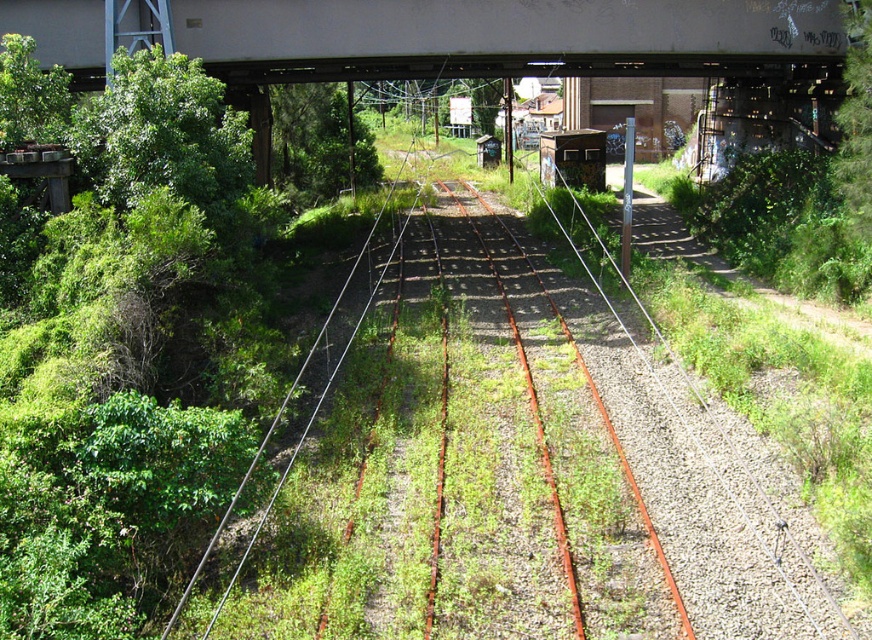
Does point (142, 161) come behind point (319, 104)?

No, (142, 161) is in front of (319, 104).

Looking at this image, which is above, green leafy tree at left or green leafy tree at center?

green leafy tree at center is higher up.

Measure the distance between green leafy tree at left and camera.

The distance of green leafy tree at left from camera is 12.51 meters.

At what (x,y) coordinates should I click in order to perform the action: click on green leafy tree at left. Please return your answer as a coordinate pair (x, y). Image resolution: width=872 pixels, height=640 pixels. Looking at the image, I should click on (161, 134).

Is green grassy track at center smaller than white painted steel bridge at upper center?

Yes, green grassy track at center is smaller than white painted steel bridge at upper center.

Can you confirm if green grassy track at center is bigger than white painted steel bridge at upper center?

No.

Which is in front, point (400, 268) or point (288, 17)?

Point (288, 17) is more forward.

I want to click on green grassy track at center, so click(x=505, y=468).

Which is in front, point (403, 508) or point (319, 88)?

Point (403, 508) is more forward.

Does green grassy track at center appear on the right side of green leafy tree at center?

Correct, you'll find green grassy track at center to the right of green leafy tree at center.

Who is more distant from viewer, [482,628] or [327,164]?

Positioned behind is point [327,164].

Where is `green grassy track at center`? green grassy track at center is located at coordinates (505, 468).